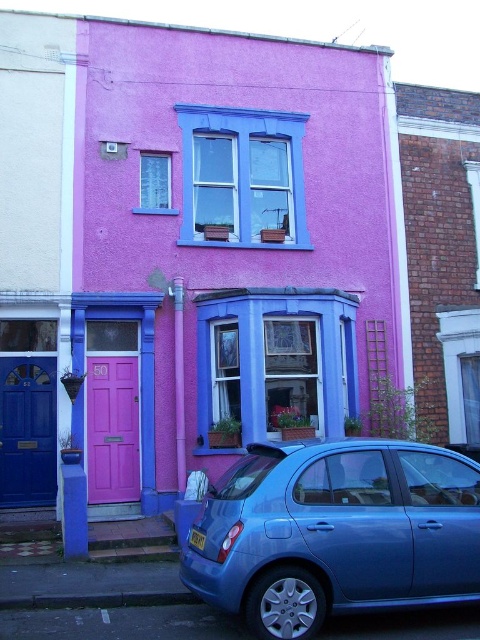
You are a delivery person trying to deliver a package to the pink matte door at center. However, there is a matte blue door at left nearby. Which door is wider?

The matte blue door at left might be wider than the pink matte door at center, so it is possible that the blue door is wider. However, without exact measurements, we cannot be certain.

You are a delivery person approaching the house with the number 50. You need to park your vehicle in front of the matte blue door at left. However, there is a metallic blue hatchback at lower center already parked there. Can you park your vehicle without moving the existing car?

The metallic blue hatchback at lower center is to the right of the matte blue door at left, so there is space to park your vehicle to the left of the existing car near the matte blue door at left.